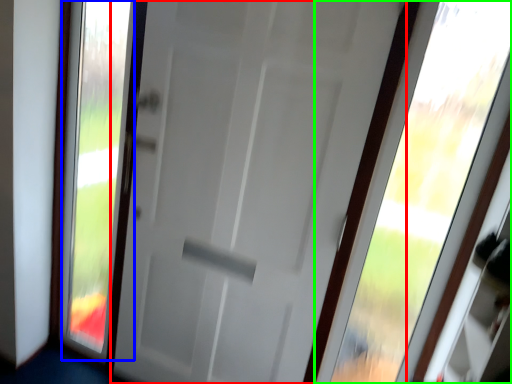
Question: Which object is the farthest from door (highlighted by a red box)? Choose among these: glass window (highlighted by a blue box) or window (highlighted by a green box).

Choices:
 (A) glass window
 (B) window

Answer: (B)